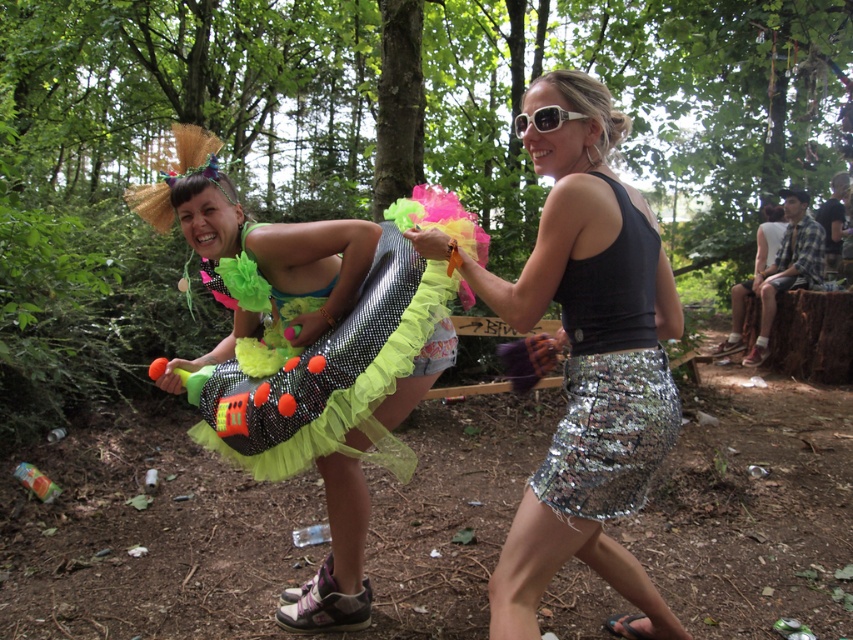
You are standing at the edge of the forest looking at the scene. If you want to aim a water gun at the shiny sequin skirt at center, where should you aim in terms of coordinates?

You should aim at the coordinates point (589,358) to hit the shiny sequin skirt at center.

You are a photographer standing at the camera position. You want to capture a closeup shot of the shiny sequined dress at center. Considering your current position, can you estimate if you need to move closer or farther away to achieve a closer focus on the dress?

The shiny sequined dress at center is currently 2.12 meters away from the camera. To get a closer focus, you would need to move closer to reduce the distance between the camera and the dress.

In the scene shown: You are a photographer at the festival and want to capture both the shiny sequined dress at center and the silver sequined skirt at center in a single shot. Which object should you focus on first to ensure both are in frame?

The shiny sequined dress at center is positioned under the silver sequined skirt at center, so focusing on the silver sequined skirt at center first would allow the dress to naturally fall into the frame below it.